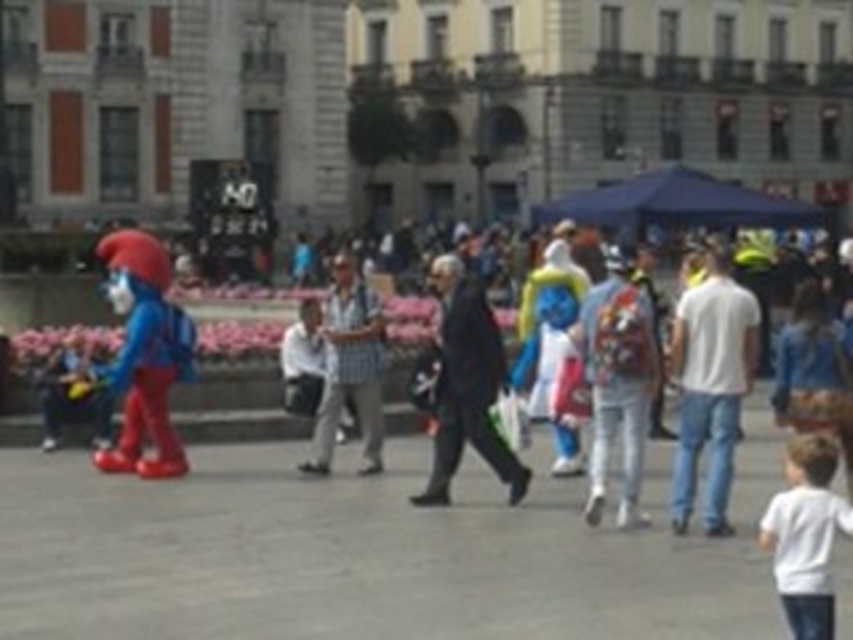
Is plush blue costume at left thinner than white matte shirt at lower right?

No.

Is plush blue costume at left shorter than white matte shirt at lower right?

In fact, plush blue costume at left may be taller than white matte shirt at lower right.

Describe the element at coordinates (143, 353) in the screenshot. I see `plush blue costume at left` at that location.

What are the coordinates of `plush blue costume at left` in the screenshot? It's located at (143, 353).

Is point (712, 372) closer to viewer compared to point (450, 451)?

That is True.

Can you confirm if white cotton shirt at center-right is taller than dark suit at center?

No.

The width and height of the screenshot is (853, 640). Find the location of `white cotton shirt at center-right`. white cotton shirt at center-right is located at coordinates (711, 385).

The image size is (853, 640). What are the coordinates of `white cotton shirt at center-right` in the screenshot? It's located at click(711, 385).

Can you confirm if white matte shirt at lower right is thinner than checkered fabric shirt at center?

Yes, white matte shirt at lower right is thinner than checkered fabric shirt at center.

I want to click on white matte shirt at lower right, so click(805, 536).

The image size is (853, 640). I want to click on white matte shirt at lower right, so click(x=805, y=536).

At what (x,y) coordinates should I click in order to perform the action: click on white matte shirt at lower right. Please return your answer as a coordinate pair (x, y). Looking at the image, I should click on (805, 536).